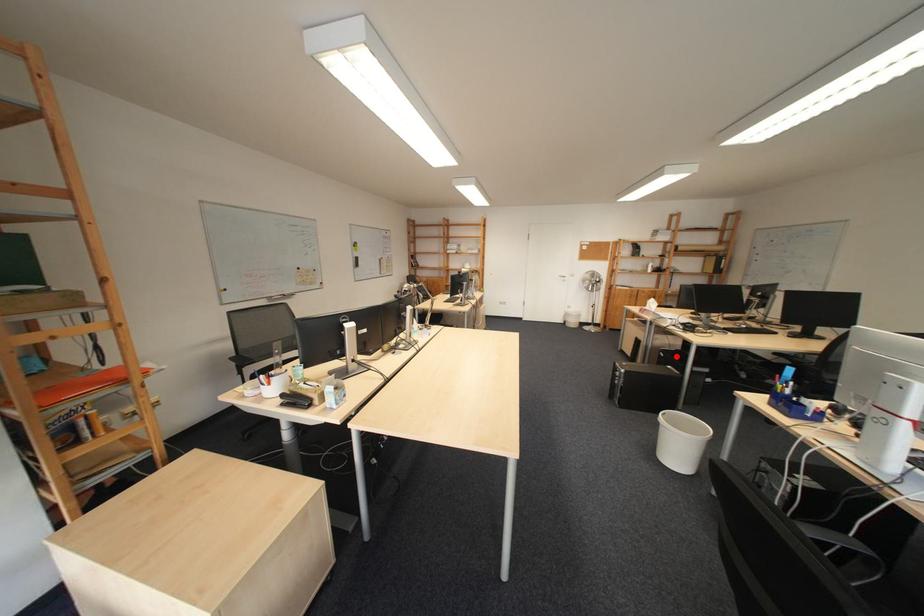
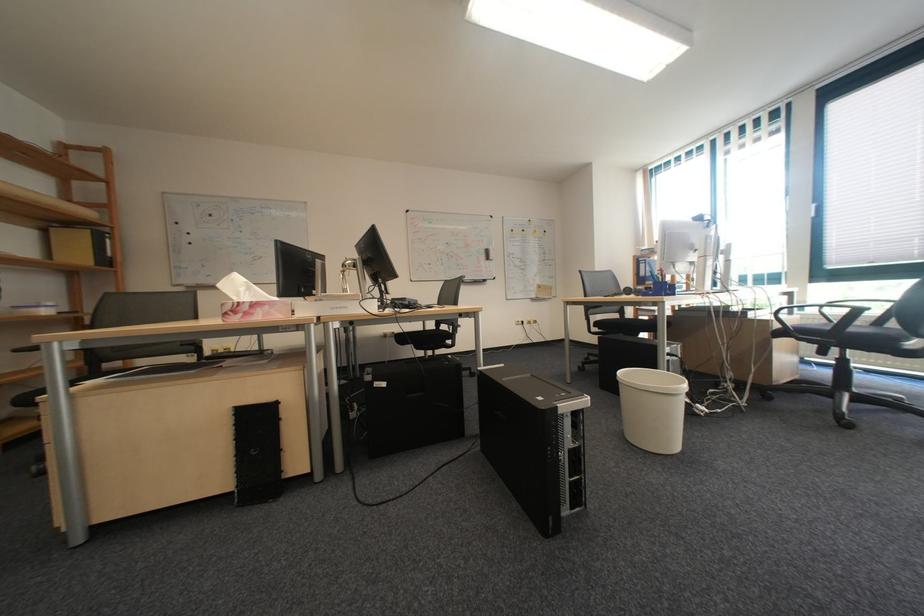
Question: I am providing you with two images of the same scene from different viewpoints. Given a red point in image1, look at the same physical point in image2. Is it:

Choices:
 (A) Closer to the viewpoint
 (B) Farther from the viewpoint

Answer: (B)